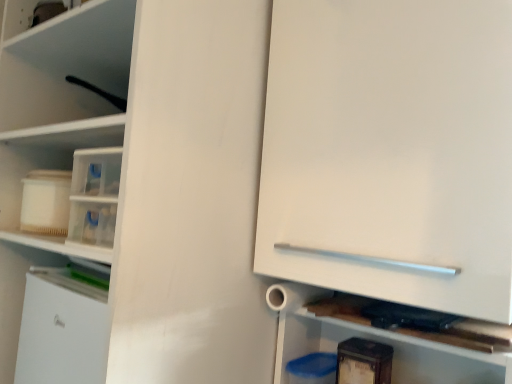
In order to face white glossy cabinet at center, should I rotate leftwards or rightwards?

A 18.870 degree turn to the right will do.

Find the location of a particular element. The height and width of the screenshot is (384, 512). white glossy cabinet at center is located at coordinates (391, 150).

What do you see at coordinates (391, 150) in the screenshot?
I see `white glossy cabinet at center` at bounding box center [391, 150].

The height and width of the screenshot is (384, 512). I want to click on wooden cutting board at lower right, so pyautogui.click(x=412, y=339).

Describe the element at coordinates (412, 339) in the screenshot. I see `wooden cutting board at lower right` at that location.

I want to click on white glossy cabinet at center, so click(391, 150).

Considering the positions of objects wooden cutting board at lower right and white glossy cabinet at center in the image provided, who is more to the left, wooden cutting board at lower right or white glossy cabinet at center?

Positioned to the left is wooden cutting board at lower right.

Is wooden cutting board at lower right positioned before white glossy cabinet at center?

No, wooden cutting board at lower right is further to the viewer.

Between point (502, 359) and point (365, 193), which one is positioned behind?

The point (365, 193) is farther from the camera.

From the image's perspective, is wooden cutting board at lower right over white glossy cabinet at center?

Incorrect, from the image's perspective, wooden cutting board at lower right is lower than white glossy cabinet at center.

From a real-world perspective, is wooden cutting board at lower right above or below white glossy cabinet at center?

Clearly, from a real-world perspective, wooden cutting board at lower right is below white glossy cabinet at center.

In the scene shown: Is wooden cutting board at lower right wider or thinner than white glossy cabinet at center?

Considering their sizes, wooden cutting board at lower right looks slimmer than white glossy cabinet at center.

Considering the sizes of objects wooden cutting board at lower right and white glossy cabinet at center in the image provided, who is shorter, wooden cutting board at lower right or white glossy cabinet at center?

With less height is wooden cutting board at lower right.

Can you confirm if wooden cutting board at lower right is bigger than white glossy cabinet at center?

No, wooden cutting board at lower right is not bigger than white glossy cabinet at center.

Is wooden cutting board at lower right outside of white glossy cabinet at center?

Yes.

Is wooden cutting board at lower right far away from white glossy cabinet at center?

wooden cutting board at lower right is near white glossy cabinet at center, not far away.

Is white glossy cabinet at center at the back of wooden cutting board at lower right?

No.

Measure the distance from wooden cutting board at lower right to white glossy cabinet at center.

wooden cutting board at lower right is 34.12 centimeters away from white glossy cabinet at center.

Locate an element on the screen. The image size is (512, 384). cabinetry that appears in front of the wooden cutting board at lower right is located at coordinates (391, 150).

Is white glossy cabinet at center at the right side of wooden cutting board at lower right?

Yes.

Which object is closer to the camera taking this photo, white glossy cabinet at center or wooden cutting board at lower right?

Positioned in front is white glossy cabinet at center.

Is point (268, 227) positioned in front of point (301, 308)?

Yes, it is in front of point (301, 308).

In the scene shown: From the image's perspective, does white glossy cabinet at center appear higher than wooden cutting board at lower right?

Correct, white glossy cabinet at center appears higher than wooden cutting board at lower right in the image.

From a real-world perspective, which is physically above, white glossy cabinet at center or wooden cutting board at lower right?

white glossy cabinet at center, from a real-world perspective.

Is white glossy cabinet at center thinner than wooden cutting board at lower right?

Incorrect, the width of white glossy cabinet at center is not less than that of wooden cutting board at lower right.

Is white glossy cabinet at center taller than wooden cutting board at lower right?

Yes.

Based on their sizes in the image, would you say white glossy cabinet at center is bigger or smaller than wooden cutting board at lower right?

Considering their sizes, white glossy cabinet at center takes up more space than wooden cutting board at lower right.

Is white glossy cabinet at center outside of wooden cutting board at lower right?

white glossy cabinet at center lies outside wooden cutting board at lower right's area.

Is white glossy cabinet at center in contact with wooden cutting board at lower right?

No, white glossy cabinet at center is not making contact with wooden cutting board at lower right.

Is white glossy cabinet at center oriented towards wooden cutting board at lower right?

No, white glossy cabinet at center is not turned towards wooden cutting board at lower right.

How many degrees apart are the facing directions of white glossy cabinet at center and wooden cutting board at lower right?

The facing directions of white glossy cabinet at center and wooden cutting board at lower right are 0.169 degrees apart.

How much distance is there between white glossy cabinet at center and wooden cutting board at lower right?

They are 13.43 inches apart.

Image resolution: width=512 pixels, height=384 pixels. What are the coordinates of `cabinetry positioned vertically above the wooden cutting board at lower right (from a real-world perspective)` in the screenshot? It's located at (391, 150).

Identify the location of cabinetry on the right of wooden cutting board at lower right. The height and width of the screenshot is (384, 512). [391, 150].

I want to click on cabinetry above the wooden cutting board at lower right (from a real-world perspective), so click(391, 150).